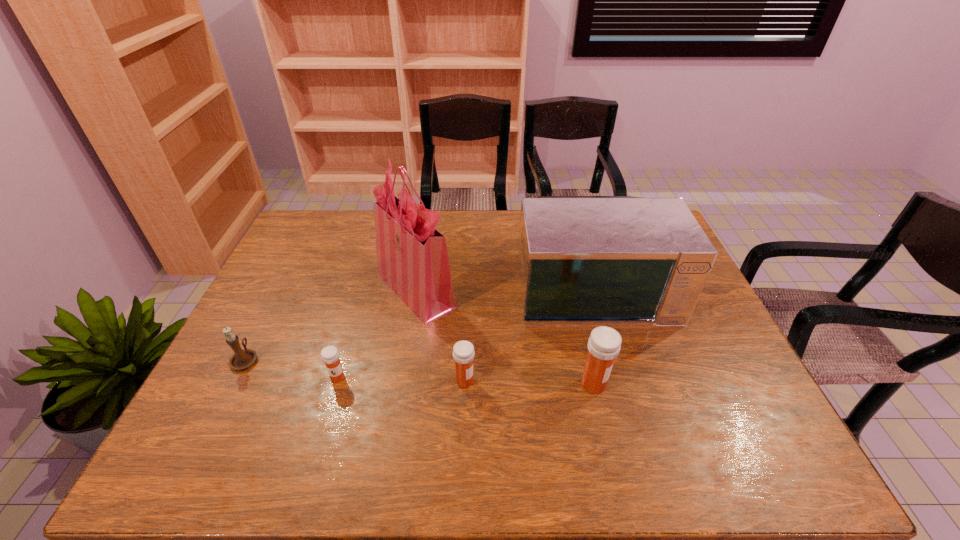
Image resolution: width=960 pixels, height=540 pixels. What are the coordinates of `the shortest object` in the screenshot? It's located at (330, 356).

Where is `the second object from left to right`? The height and width of the screenshot is (540, 960). the second object from left to right is located at coordinates pos(330,356).

Identify the location of the second shortest medicine. The height and width of the screenshot is (540, 960). (463, 351).

Where is `the fourth object from left to right`? the fourth object from left to right is located at coordinates (463, 351).

Image resolution: width=960 pixels, height=540 pixels. Identify the location of the tallest medicine. (604, 344).

You are a GUI agent. You are given a task and a screenshot of the screen. Output one action in this format:
    pyautogui.click(x=<x>, y=<y>)
    Task: Click on the rightmost medicine
    
    Given the screenshot: What is the action you would take?
    pyautogui.click(x=604, y=344)

Locate an element on the screen. the third object from left to right is located at coordinates (412, 258).

Image resolution: width=960 pixels, height=540 pixels. What are the coordinates of `shopping bag` in the screenshot? It's located at (412, 258).

This screenshot has height=540, width=960. Identify the location of the leftmost object. (241, 359).

Where is `microwave oven`? This screenshot has width=960, height=540. microwave oven is located at coordinates (582, 260).